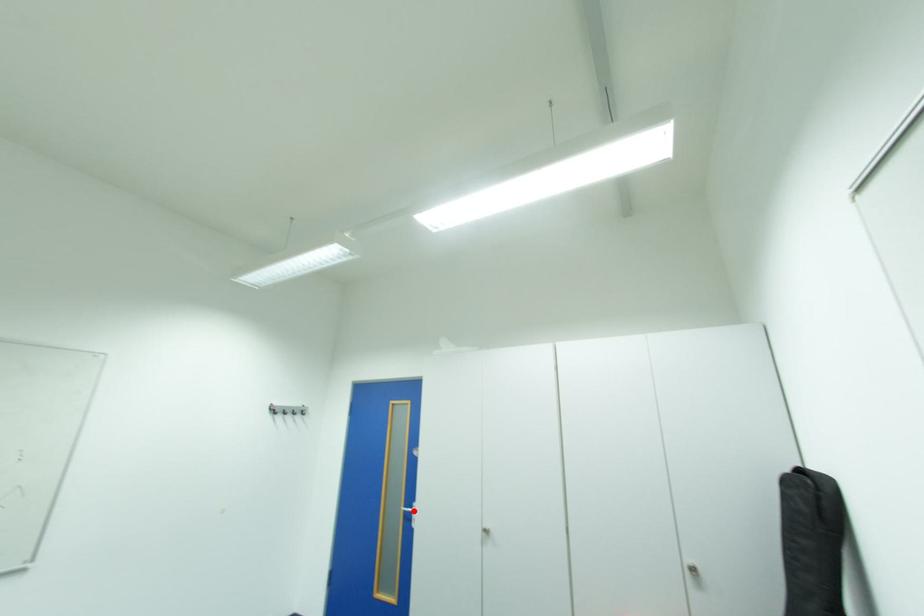
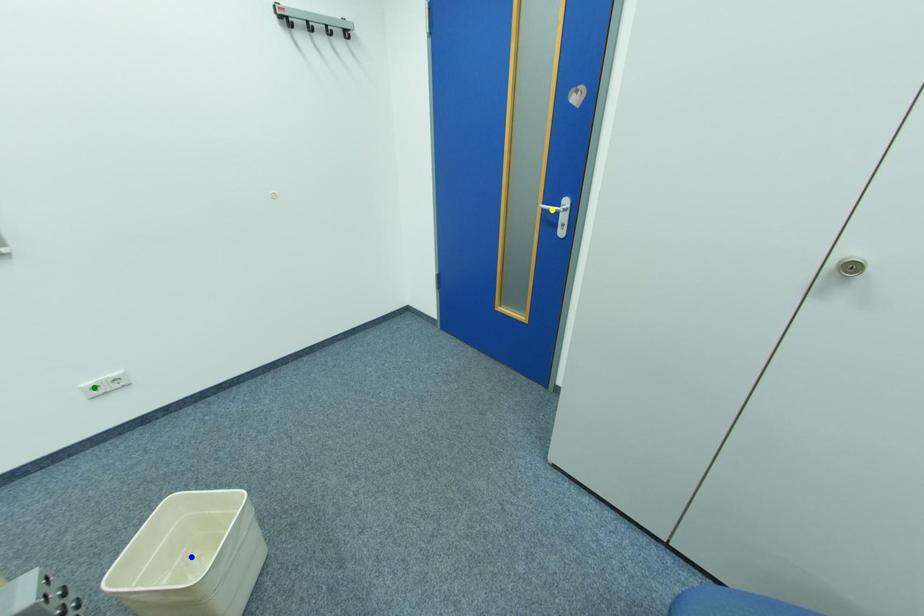
Question: I am providing you with two images of the same scene from different viewpoints. A red point is marked on the first image. You are given multiple points on the second image. Which point in image 2 represents the same 3d spot as the red point in image 1?

Choices:
 (A) yellow point
 (B) green point
 (C) blue point

Answer: (A)